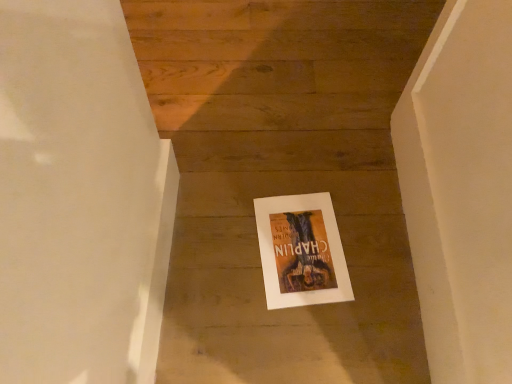
The width and height of the screenshot is (512, 384). Identify the location of vacant space underneath white paper at center (from a real-world perspective). (296, 244).